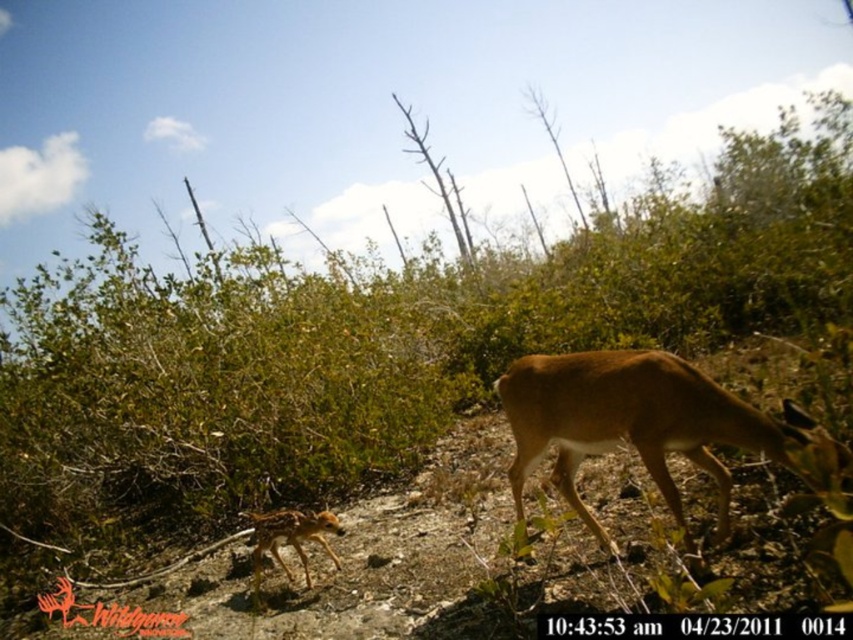
You are a hiker who wants to take a photo of the brown matte deer at center. You have a camera with a zoom lens that can focus on objects within a 0.5 unit radius. Is the point at coordinates point (631, 422) within the focus range of your camera lens?

The point at coordinates point (631, 422) corresponds to the brown matte deer at center, so yes, the camera lens can focus on it since the point is within the 0.5 unit radius focus range.